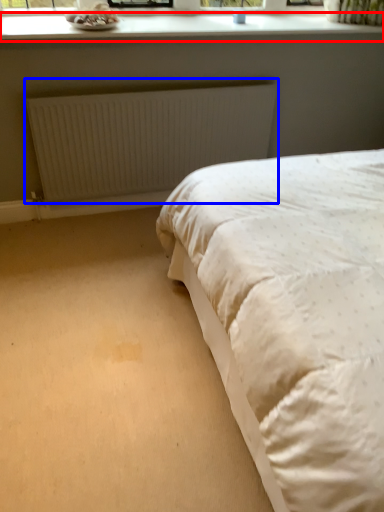
Question: Which of the following is the farthest to the observer, window sill (highlighted by a red box) or radiator (highlighted by a blue box)?

Choices:
 (A) window sill
 (B) radiator

Answer: (B)